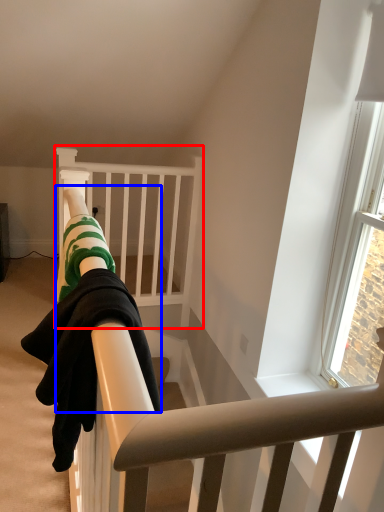
Question: Which object is further to the camera taking this photo, infant bed (highlighted by a red box) or person (highlighted by a blue box)?

Choices:
 (A) infant bed
 (B) person

Answer: (A)